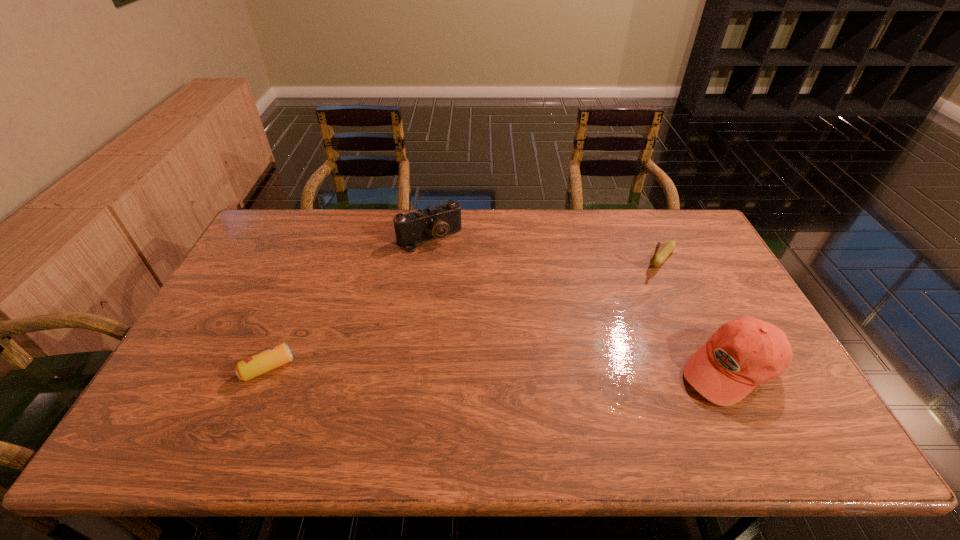
This screenshot has width=960, height=540. I want to click on vacant area that satisfies the following two spatial constraints: 1. on the front side of the banana; 2. on the right side of the camera, so click(x=427, y=258).